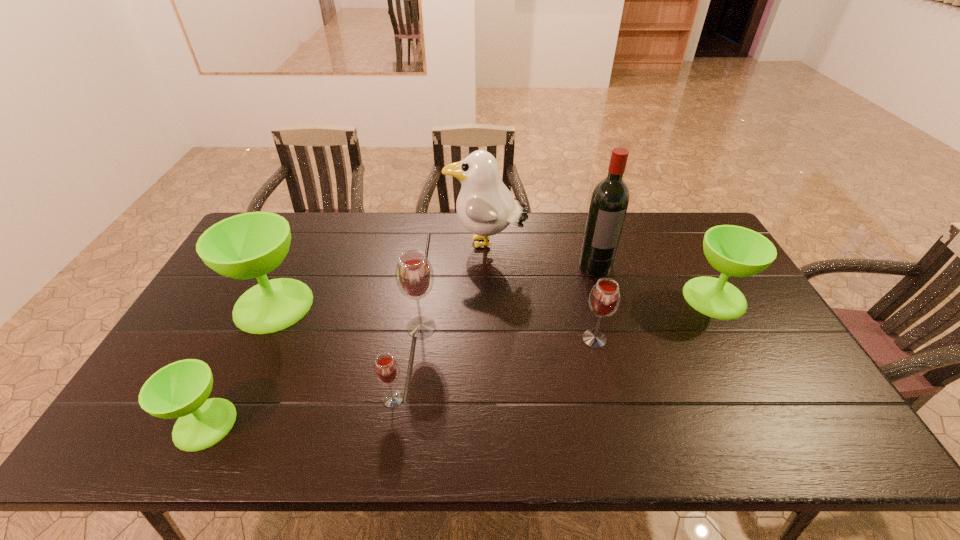
This screenshot has height=540, width=960. In order to click on the nearest green wineglass in this screenshot , I will do (180, 390).

Locate an element on the screen. free location located 0.140m on the label of the red wine bottle is located at coordinates (609, 308).

Identify the location of vacant space located 0.200m on the beak of the gull. (389, 244).

Where is `vacant space located on the beak of the gull`? This screenshot has height=540, width=960. vacant space located on the beak of the gull is located at coordinates (343, 244).

The height and width of the screenshot is (540, 960). Find the location of `vacant space located 0.390m on the beak of the gull`. vacant space located 0.390m on the beak of the gull is located at coordinates (334, 244).

Image resolution: width=960 pixels, height=540 pixels. What are the coordinates of `free spot located on the left of the biggest red wineglass` in the screenshot? It's located at (323, 327).

You are a GUI agent. You are given a task and a screenshot of the screen. Output one action in this format:
    pyautogui.click(x=<x>, y=<y>)
    Task: Click on the vacant space located 0.290m on the front of the biggest green wineglass
    The width and height of the screenshot is (960, 540).
    Given the screenshot: What is the action you would take?
    pyautogui.click(x=213, y=431)

Identify the location of vacant space located on the front of the second smallest green wineglass. The image size is (960, 540). (781, 417).

In order to click on vacant area situated 0.090m on the front of the second biggest red wineglass in this screenshot , I will do `click(604, 378)`.

This screenshot has height=540, width=960. I want to click on free space located 0.210m on the back of the smallest red wineglass, so click(405, 326).